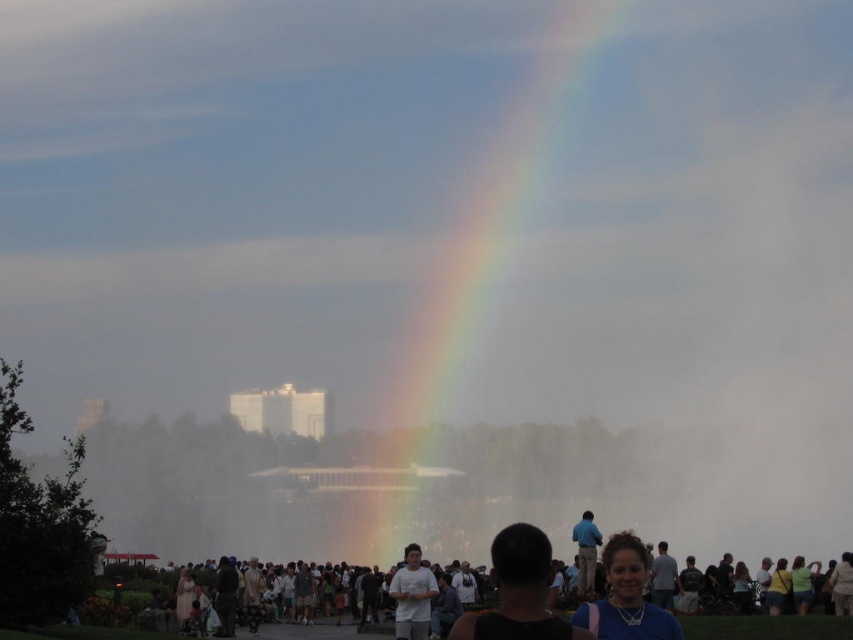
You are a photographer positioned at the center of the scene. You want to capture a closeup shot of the matte blue necklace at lower right without including the rainbow or the crowd. Is the necklace positioned in a way that allows this?

The matte blue necklace at lower right is located at point (x=625, y=596), so yes, it can be framed to exclude the rainbow and crowd by adjusting the camera angle or zoom.